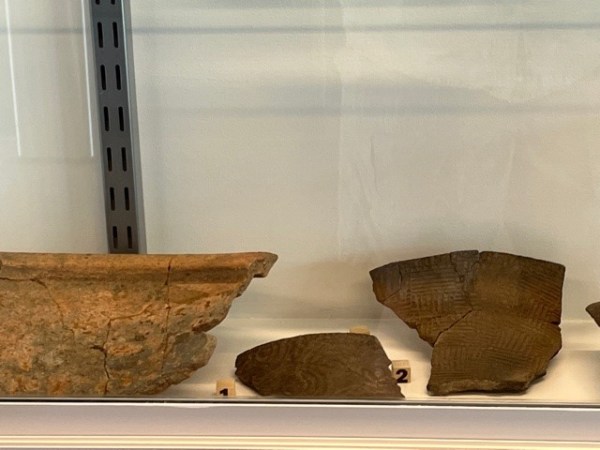
You are a GUI agent. You are given a task and a screenshot of the screen. Output one action in this format:
    pyautogui.click(x=<x>, y=<y>)
    Task: Click on the bar
    
    Given the screenshot: What is the action you would take?
    pyautogui.click(x=124, y=183)